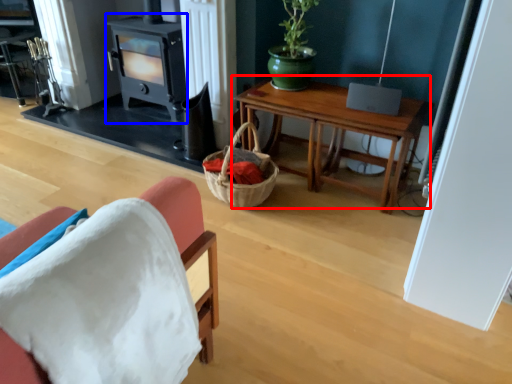
Question: Which object is further to the camera taking this photo, table (highlighted by a red box) or fireplace (highlighted by a blue box)?

Choices:
 (A) table
 (B) fireplace

Answer: (B)